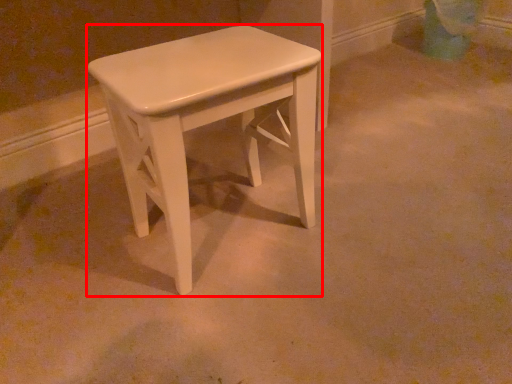
Question: Where is stool (annotated by the red box) located in relation to swivel chair in the image?

Choices:
 (A) left
 (B) right

Answer: (A)